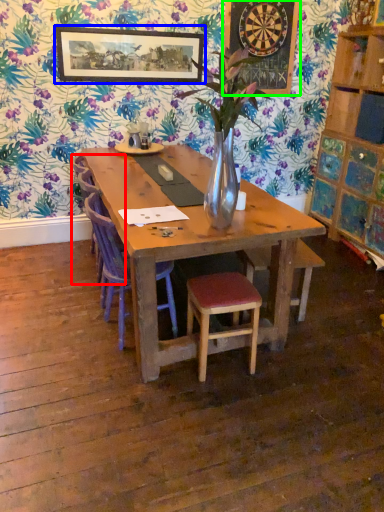
Question: Estimate the real-world distances between objects in this image. Which object is closer to armchair (highlighted by a red box), picture frame (highlighted by a blue box) or bulletin board (highlighted by a green box)?

Choices:
 (A) picture frame
 (B) bulletin board

Answer: (A)